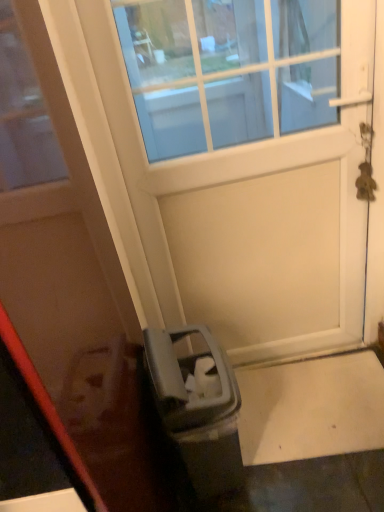
Question: Looking at their shapes, would you say white matte door at center, which is counted as the 2th door, starting from the left, is wider or thinner than white matte door at center, positioned as the 1th door in left-to-right order?

Choices:
 (A) thin
 (B) wide

Answer: (A)

Question: From a real-world perspective, is white matte door at center, which is counted as the 2th door, starting from the left, above or below white matte door at center, positioned as the 1th door in left-to-right order?

Choices:
 (A) above
 (B) below

Answer: (B)

Question: Considering the positions of white matte door at center, which is counted as the 2th door, starting from the left, and white matte door at center, positioned as the 1th door in left-to-right order, in the image, is white matte door at center, which is counted as the 2th door, starting from the left, bigger or smaller than white matte door at center, positioned as the 1th door in left-to-right order,?

Choices:
 (A) small
 (B) big

Answer: (A)

Question: From a real-world perspective, is white matte door at center, positioned as the 1th door in left-to-right order, physically located above or below white matte door at center, which is the 1th door from right to left?

Choices:
 (A) above
 (B) below

Answer: (A)

Question: Does point (67, 454) appear closer or farther from the camera than point (256, 173)?

Choices:
 (A) farther
 (B) closer

Answer: (B)

Question: Considering the relative positions of white matte door at center, which appears as the second door when viewed from the right, and white matte door at center, which is counted as the 2th door, starting from the left, in the image provided, is white matte door at center, which appears as the second door when viewed from the right, to the left or to the right of white matte door at center, which is counted as the 2th door, starting from the left,?

Choices:
 (A) right
 (B) left

Answer: (B)

Question: Is white matte door at center, which appears as the second door when viewed from the right, wider or thinner than white matte door at center, which is counted as the 2th door, starting from the left?

Choices:
 (A) wide
 (B) thin

Answer: (A)